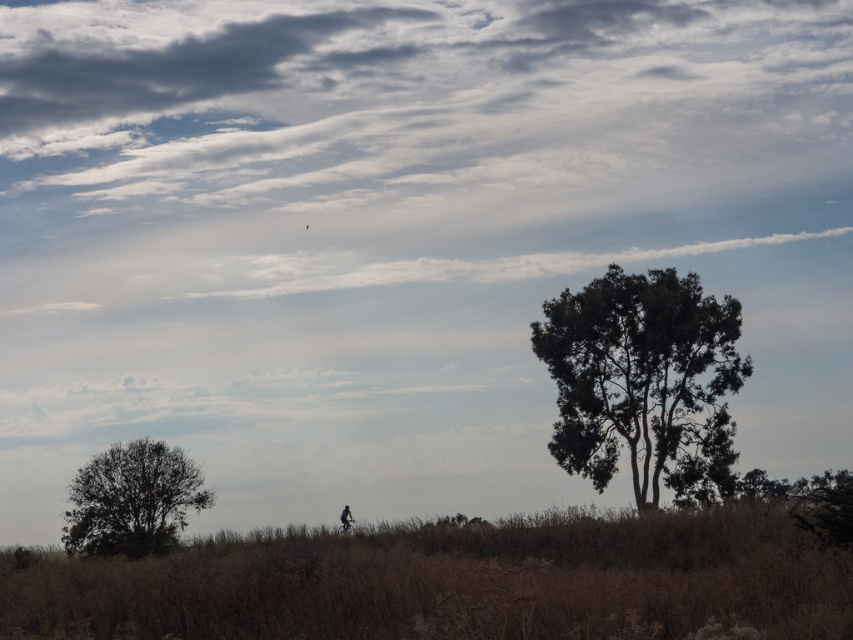
Between dark green leafy tree at lower left and dark silhouette figure at lower center, which one has less height?

With less height is dark green leafy tree at lower left.

Does dark green leafy tree at lower left have a greater height compared to dark silhouette figure at lower center?

No.

This screenshot has height=640, width=853. I want to click on dark green leafy tree at lower left, so click(x=132, y=499).

Between green leafy tree at right and dark green leafy tree at lower left, which one appears on the right side from the viewer's perspective?

green leafy tree at right

Does green leafy tree at right have a smaller size compared to dark green leafy tree at lower left?

No, green leafy tree at right is not smaller than dark green leafy tree at lower left.

The width and height of the screenshot is (853, 640). What do you see at coordinates (643, 381) in the screenshot?
I see `green leafy tree at right` at bounding box center [643, 381].

At what (x,y) coordinates should I click in order to perform the action: click on green leafy tree at right. Please return your answer as a coordinate pair (x, y). Image resolution: width=853 pixels, height=640 pixels. Looking at the image, I should click on (643, 381).

Is point (724, 465) closer to viewer compared to point (347, 506)?

Yes, it is in front of point (347, 506).

Measure the distance between green leafy tree at right and dark silhouette figure at lower center.

A distance of 11.16 meters exists between green leafy tree at right and dark silhouette figure at lower center.

You are a GUI agent. You are given a task and a screenshot of the screen. Output one action in this format:
    pyautogui.click(x=<x>, y=<y>)
    Task: Click on the green leafy tree at right
    Image resolution: width=853 pixels, height=640 pixels.
    Given the screenshot: What is the action you would take?
    pyautogui.click(x=643, y=381)

Where is `green leafy tree at right`? The width and height of the screenshot is (853, 640). green leafy tree at right is located at coordinates (643, 381).